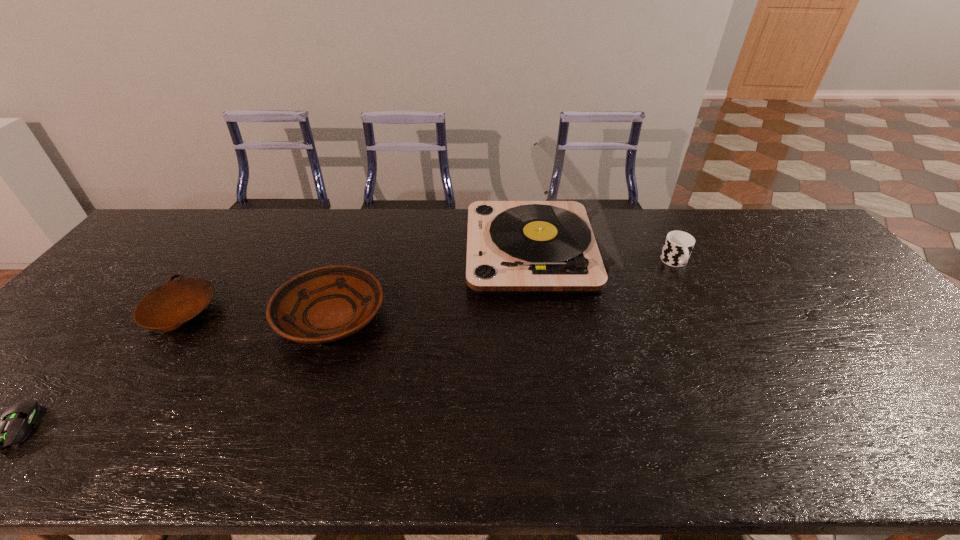
Image resolution: width=960 pixels, height=540 pixels. Identify the location of record player. (564, 245).

The width and height of the screenshot is (960, 540). Identify the location of the tallest object. (564, 245).

Identify the location of the fourth shortest object. (678, 245).

Locate an element on the screen. cup is located at coordinates (678, 245).

Find the location of a particular element. the third object from right to left is located at coordinates (326, 304).

This screenshot has width=960, height=540. Find the location of `the right plate`. the right plate is located at coordinates (326, 304).

This screenshot has width=960, height=540. I want to click on the fourth object from right to left, so click(167, 307).

Locate an element on the screen. the left plate is located at coordinates (167, 307).

The width and height of the screenshot is (960, 540). I want to click on vacant space located 0.270m with the tonearm facing the front of the record player, so click(x=383, y=251).

Find the location of a particular element. The height and width of the screenshot is (540, 960). vacant space positioned 0.220m with the tonearm facing the front of the record player is located at coordinates (398, 251).